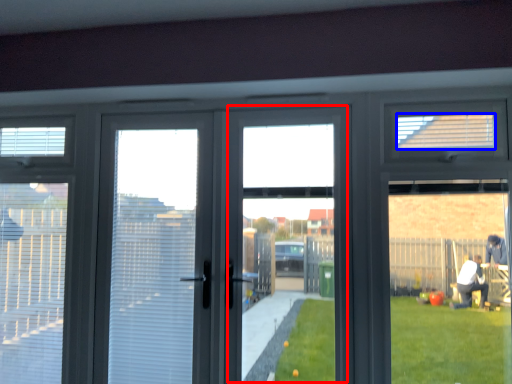
Question: Which of the following is the closest to the observer, window screen (highlighted by a red box) or blind (highlighted by a blue box)?

Choices:
 (A) window screen
 (B) blind

Answer: (A)